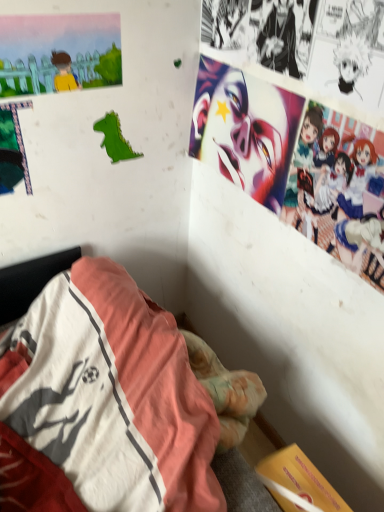
You are a GUI agent. You are given a task and a screenshot of the screen. Output one action in this format:
    pyautogui.click(x=<x>, y=<y>)
    Task: Click on the vivid matte clown face at upper right
    This screenshot has width=384, height=512.
    Given the screenshot: What is the action you would take?
    pyautogui.click(x=246, y=136)

You are a GUI agent. You are given a task and a screenshot of the screen. Output one action in this format:
    pyautogui.click(x=<x>, y=<y>)
    Task: Click on the black paper at upper right, which ranks as the first person in left-to-right order
    
    Given the screenshot: What is the action you would take?
    pyautogui.click(x=279, y=40)

Is point (102, 125) positioned before point (281, 162)?

No, it is behind (281, 162).

Considering the sizes of objects green paper dinosaur at upper left and vivid matte clown face at upper right in the image provided, who is thinner, green paper dinosaur at upper left or vivid matte clown face at upper right?

green paper dinosaur at upper left.

From a real-world perspective, which is physically below, green paper dinosaur at upper left or vivid matte clown face at upper right?

green paper dinosaur at upper left is physically lower.

In the image, is green paper dinosaur at upper left positioned in front of or behind vivid matte clown face at upper right?

Clearly, green paper dinosaur at upper left is behind vivid matte clown face at upper right.

Do you think matte paper painting at upper left, acting as the first poster page starting from the left, is within green paper dinosaur at upper left, or outside of it?

The correct answer is: outside.

Considering the relative positions of matte paper painting at upper left, the 2th poster page positioned from the right, and green paper dinosaur at upper left in the image provided, is matte paper painting at upper left, the 2th poster page positioned from the right, to the left of green paper dinosaur at upper left from the viewer's perspective?

Yes, matte paper painting at upper left, the 2th poster page positioned from the right, is to the left of green paper dinosaur at upper left.

Is the position of matte paper painting at upper left, the first poster page from the top, less distant than that of green paper dinosaur at upper left?

That is True.

Is matte paper painting at upper left, arranged as the second poster page when ordered from the bottom, with green paper dinosaur at upper left?

matte paper painting at upper left, arranged as the second poster page when ordered from the bottom, and green paper dinosaur at upper left are clearly separated.

Is pastel-colored anime characters at upper right, which ranks as the 1th person in bottom-to-top order, in front of or behind vivid matte clown face at upper right in the image?

Clearly, pastel-colored anime characters at upper right, which ranks as the 1th person in bottom-to-top order, is in front of vivid matte clown face at upper right.

Is pastel-colored anime characters at upper right, marked as the second person in a left-to-right arrangement, in contact with vivid matte clown face at upper right?

pastel-colored anime characters at upper right, marked as the second person in a left-to-right arrangement, and vivid matte clown face at upper right are not in contact.

How many degrees apart are the facing directions of pastel-colored anime characters at upper right, the first person positioned from the right, and vivid matte clown face at upper right?

The facing directions of pastel-colored anime characters at upper right, the first person positioned from the right, and vivid matte clown face at upper right are 0.013 degrees apart.

From a real-world perspective, is pastel-colored anime characters at upper right, marked as the 2th person in a top-to-bottom arrangement, below vivid matte clown face at upper right?

Yes, from a real-world perspective, pastel-colored anime characters at upper right, marked as the 2th person in a top-to-bottom arrangement, is under vivid matte clown face at upper right.

Where is `poster page located above the vivid matte clown face at upper right (from a real-world perspective)`? This screenshot has width=384, height=512. poster page located above the vivid matte clown face at upper right (from a real-world perspective) is located at coordinates (59, 53).

How far apart are matte paper painting at upper left, the first poster page from the top, and vivid matte clown face at upper right?

39.45 centimeters.

Is matte paper painting at upper left, the 2th poster page positioned from the right, located outside vivid matte clown face at upper right?

Yes.

Is matte paper painting at upper left, acting as the first poster page starting from the left, next to vivid matte clown face at upper right?

No, matte paper painting at upper left, acting as the first poster page starting from the left, is not touching vivid matte clown face at upper right.

Choose the correct answer: Is matte paper painting at upper left, the first poster page from the top, inside black paper at upper right, which ranks as the first person in left-to-right order, or outside it?

matte paper painting at upper left, the first poster page from the top, is not inside black paper at upper right, which ranks as the first person in left-to-right order, it's outside.

Which of these two, matte paper painting at upper left, the 2th poster page positioned from the right, or black paper at upper right, arranged as the 2th person when viewed from the right, is smaller?

Smaller between the two is matte paper painting at upper left, the 2th poster page positioned from the right.

Could you measure the distance between matte paper painting at upper left, arranged as the second poster page when ordered from the bottom, and black paper at upper right, the 1th person positioned from the top?

matte paper painting at upper left, arranged as the second poster page when ordered from the bottom, and black paper at upper right, the 1th person positioned from the top, are 17.88 inches apart from each other.

From a real-world perspective, who is located higher, matte paper painting at upper left, the first poster page from the top, or black paper at upper right, which ranks as the first person in left-to-right order?

black paper at upper right, which ranks as the first person in left-to-right order, is physically above.

Does vivid matte clown face at upper right lie in front of black paper at upper right, arranged as the 2th person when viewed from the right?

That is False.

Image resolution: width=384 pixels, height=512 pixels. I want to click on the 1st person counting from the right side of the vivid matte clown face at upper right, so click(x=279, y=40).

Can you tell me how much vivid matte clown face at upper right and black paper at upper right, which ranks as the first person in left-to-right order, differ in facing direction?

The angle between the facing direction of vivid matte clown face at upper right and the facing direction of black paper at upper right, which ranks as the first person in left-to-right order, is 0.896 degrees.

Considering the relative sizes of vivid matte clown face at upper right and black paper at upper right, the 2th person in the bottom-to-top sequence, in the image provided, is vivid matte clown face at upper right thinner than black paper at upper right, the 2th person in the bottom-to-top sequence,?

No, vivid matte clown face at upper right is not thinner than black paper at upper right, the 2th person in the bottom-to-top sequence.

From the image's perspective, which object appears higher, vivid matte clown face at upper right or green paper dinosaur at upper left?

green paper dinosaur at upper left appears higher in the image.

Is vivid matte clown face at upper right aimed at green paper dinosaur at upper left?

Yes, vivid matte clown face at upper right is facing green paper dinosaur at upper left.

Based on the photo, is vivid matte clown face at upper right wider than green paper dinosaur at upper left?

Yes.

Considering the relative sizes of vivid matte clown face at upper right and green paper dinosaur at upper left in the image provided, is vivid matte clown face at upper right shorter than green paper dinosaur at upper left?

No, vivid matte clown face at upper right is not shorter than green paper dinosaur at upper left.

You are a GUI agent. You are given a task and a screenshot of the screen. Output one action in this format:
    pyautogui.click(x=<x>, y=<y>)
    Task: Click on the art behind the vivid matte clown face at upper right
    The width and height of the screenshot is (384, 512).
    Given the screenshot: What is the action you would take?
    pyautogui.click(x=114, y=139)

At what (x,y) coordinates should I click in order to perform the action: click on art below the matte paper painting at upper left, acting as the first poster page starting from the left (from the image's perspective). Please return your answer as a coordinate pair (x, y). Looking at the image, I should click on (114, 139).

From the image, which object appears to be farther from black paper at upper right, which ranks as the first person in left-to-right order, pastel-colored anime characters at upper right, the first person positioned from the right, or orange matte poster at lower right, acting as the 1th poster page starting from the right?

Based on the image, orange matte poster at lower right, acting as the 1th poster page starting from the right, appears to be further to black paper at upper right, which ranks as the first person in left-to-right order.

When comparing their distances from orange matte poster at lower right, acting as the 1th poster page starting from the bottom, does black paper at upper right, the 2th person in the bottom-to-top sequence, or matte paper painting at upper left, the 2th poster page positioned from the right, seem further?

matte paper painting at upper left, the 2th poster page positioned from the right, lies further to orange matte poster at lower right, acting as the 1th poster page starting from the bottom, than the other object.

Which object lies further to the anchor point orange matte poster at lower right, the second poster page when ordered from top to bottom, green paper dinosaur at upper left or pastel-colored anime characters at upper right, which ranks as the 1th person in bottom-to-top order?

green paper dinosaur at upper left.

Which object lies further to the anchor point matte paper painting at upper left, arranged as the second poster page when ordered from the bottom, green paper dinosaur at upper left or orange matte poster at lower right, acting as the 1th poster page starting from the right?

Among the two, orange matte poster at lower right, acting as the 1th poster page starting from the right, is located further to matte paper painting at upper left, arranged as the second poster page when ordered from the bottom.

Which object lies nearer to the anchor point matte paper painting at upper left, the 2th poster page positioned from the right, orange matte poster at lower right, acting as the 1th poster page starting from the right, or pastel-colored anime characters at upper right, the first person positioned from the right?

Among the two, pastel-colored anime characters at upper right, the first person positioned from the right, is located nearer to matte paper painting at upper left, the 2th poster page positioned from the right.

From the image, which object appears to be nearer to orange matte poster at lower right, the second poster page when ordered from top to bottom, green paper dinosaur at upper left or matte paper painting at upper left, acting as the first poster page starting from the left?

green paper dinosaur at upper left lies closer to orange matte poster at lower right, the second poster page when ordered from top to bottom, than the other object.

Looking at the image, which one is located closer to green paper dinosaur at upper left, pastel-colored anime characters at upper right, the first person positioned from the right, or matte paper painting at upper left, acting as the first poster page starting from the left?

matte paper painting at upper left, acting as the first poster page starting from the left, lies closer to green paper dinosaur at upper left than the other object.

Looking at the image, which one is located closer to matte paper painting at upper left, arranged as the second poster page when ordered from the bottom, pastel-colored anime characters at upper right, marked as the 2th person in a top-to-bottom arrangement, or vivid matte clown face at upper right?

vivid matte clown face at upper right is closer to matte paper painting at upper left, arranged as the second poster page when ordered from the bottom.

Locate an element on the screen. Image resolution: width=384 pixels, height=512 pixels. poster page between black paper at upper right, the 2th person in the bottom-to-top sequence, and orange matte poster at lower right, the second poster page when ordered from top to bottom, vertically is located at coordinates (59, 53).

Find the location of a particular element. This screenshot has height=512, width=384. art that lies between black paper at upper right, the 2th person in the bottom-to-top sequence, and orange matte poster at lower right, the second poster page when ordered from top to bottom, from top to bottom is located at coordinates (114, 139).

The height and width of the screenshot is (512, 384). What are the coordinates of `human face that lies between green paper dinosaur at upper left and orange matte poster at lower right, the second poster page when ordered from top to bottom, from top to bottom` in the screenshot? It's located at (246, 136).

This screenshot has width=384, height=512. Find the location of `person that lies between black paper at upper right, which ranks as the first person in left-to-right order, and orange matte poster at lower right, the second poster page when ordered from top to bottom, from top to bottom`. person that lies between black paper at upper right, which ranks as the first person in left-to-right order, and orange matte poster at lower right, the second poster page when ordered from top to bottom, from top to bottom is located at coordinates (339, 190).